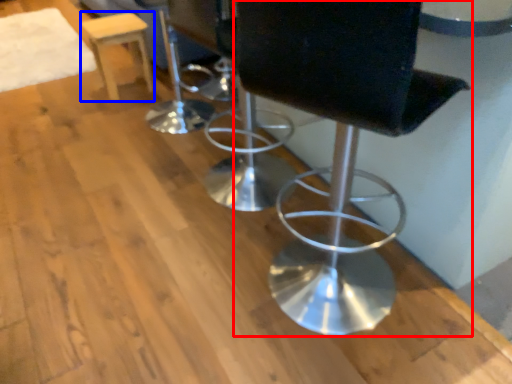
Question: Which object appears farthest to the camera in this image, chair (highlighted by a red box) or stool (highlighted by a blue box)?

Choices:
 (A) chair
 (B) stool

Answer: (B)